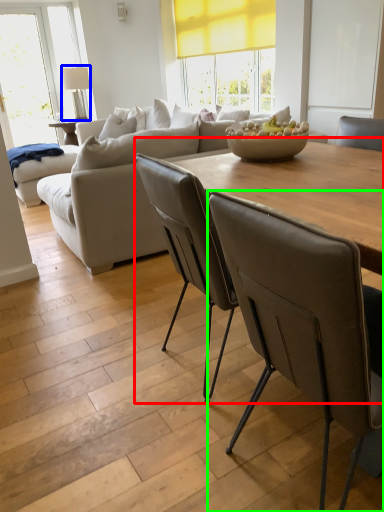
Question: Based on their relative distances, which object is farther from table (highlighted by a red box)? Choose from lamp (highlighted by a blue box) and chair (highlighted by a green box).

Choices:
 (A) lamp
 (B) chair

Answer: (A)